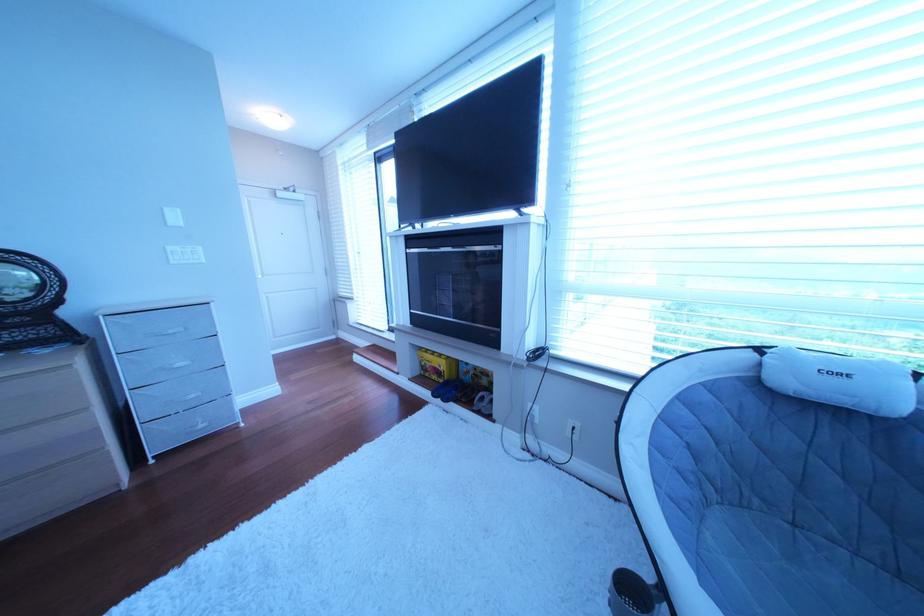
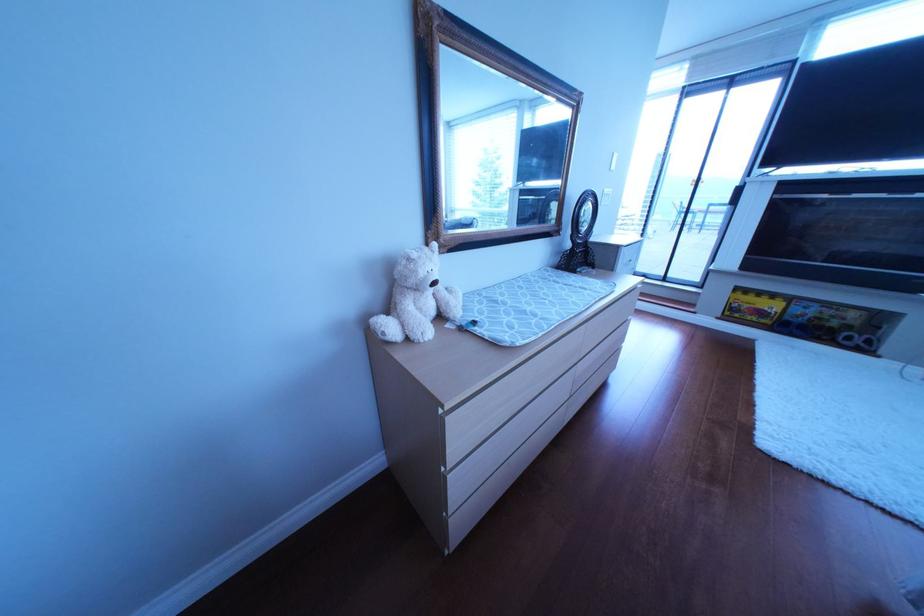
Find the pixel in the second image that matches point (424, 382) in the first image.

(733, 320)